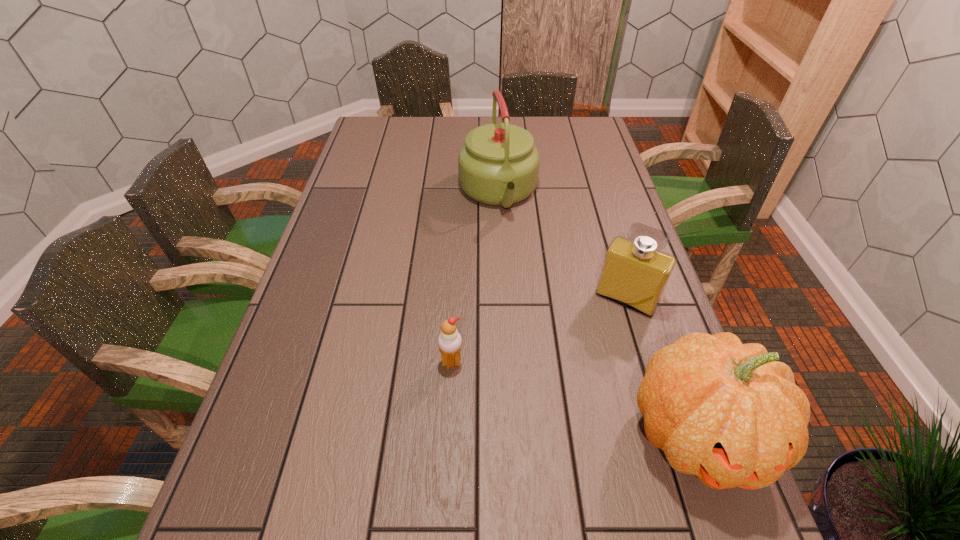
Find the location of `vacant space at the far left corner`. vacant space at the far left corner is located at coordinates (404, 117).

Find the location of a particular element. vacant space that is in between the farthest object and the pumpkin is located at coordinates (597, 314).

At what (x,y) coordinates should I click in order to perform the action: click on free point between the perfume and the kettle. Please return your answer as a coordinate pair (x, y). The width and height of the screenshot is (960, 540). Looking at the image, I should click on (563, 246).

At what (x,y) coordinates should I click in order to perform the action: click on free space between the icecream and the nearest object. Please return your answer as a coordinate pair (x, y). The width and height of the screenshot is (960, 540). Looking at the image, I should click on (574, 399).

The width and height of the screenshot is (960, 540). Find the location of `empty location between the farthest object and the third nearest object`. empty location between the farthest object and the third nearest object is located at coordinates (563, 246).

Identify the location of free area in between the nearest object and the shortest object. The image size is (960, 540). (574, 399).

Where is `free point between the third tallest object and the icecream`? Image resolution: width=960 pixels, height=540 pixels. free point between the third tallest object and the icecream is located at coordinates (539, 331).

You are a GUI agent. You are given a task and a screenshot of the screen. Output one action in this format:
    pyautogui.click(x=<x>, y=<y>)
    Task: Click on the vacant region between the shortest object and the pumpkin
    Image resolution: width=960 pixels, height=540 pixels.
    Given the screenshot: What is the action you would take?
    pyautogui.click(x=574, y=399)

Where is `the second closest object relative to the shortest object`? This screenshot has height=540, width=960. the second closest object relative to the shortest object is located at coordinates [635, 272].

Where is `object that can be found as the third closest to the perfume`? object that can be found as the third closest to the perfume is located at coordinates (449, 341).